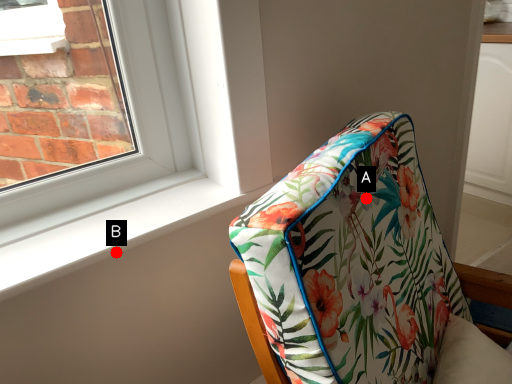
Question: Two points are circled on the image, labeled by A and B beside each circle. Which point is farther to the camera?

Choices:
 (A) A is further
 (B) B is further

Answer: (B)